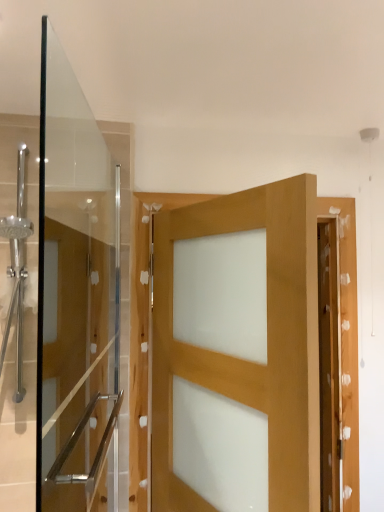
Question: From a real-world perspective, is clear glass door at left physically located above or below natural wood door at center?

Choices:
 (A) below
 (B) above

Answer: (B)

Question: Would you say clear glass door at left is to the left or to the right of natural wood door at center in the picture?

Choices:
 (A) left
 (B) right

Answer: (A)

Question: Is clear glass door at left bigger or smaller than natural wood door at center?

Choices:
 (A) big
 (B) small

Answer: (B)

Question: In terms of height, does natural wood door at center look taller or shorter compared to clear glass door at left?

Choices:
 (A) short
 (B) tall

Answer: (A)

Question: From the image's perspective, is natural wood door at center located above or below clear glass door at left?

Choices:
 (A) below
 (B) above

Answer: (A)

Question: Based on their positions, is natural wood door at center located to the left or right of clear glass door at left?

Choices:
 (A) right
 (B) left

Answer: (A)

Question: From a real-world perspective, is natural wood door at center positioned above or below clear glass door at left?

Choices:
 (A) below
 (B) above

Answer: (A)